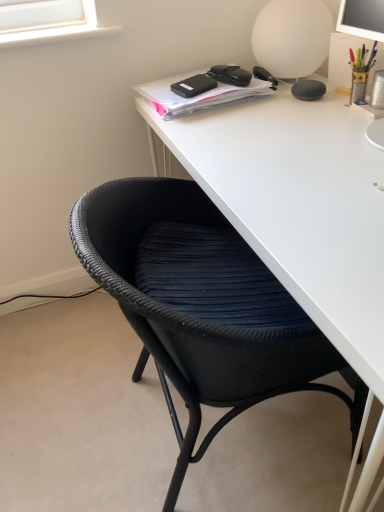
The height and width of the screenshot is (512, 384). In order to click on blank space situated above black woven chair at lower left (from a real-world perspective) in this screenshot , I will do `click(267, 185)`.